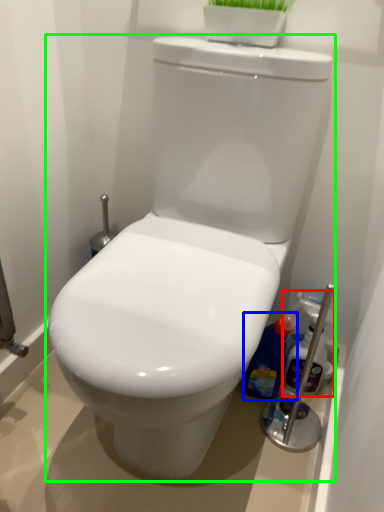
Question: Which object is positioned farthest from cleaning product (highlighted by a red box)? Select from cleaning product (highlighted by a blue box) and toilet (highlighted by a green box).

Choices:
 (A) cleaning product
 (B) toilet

Answer: (B)